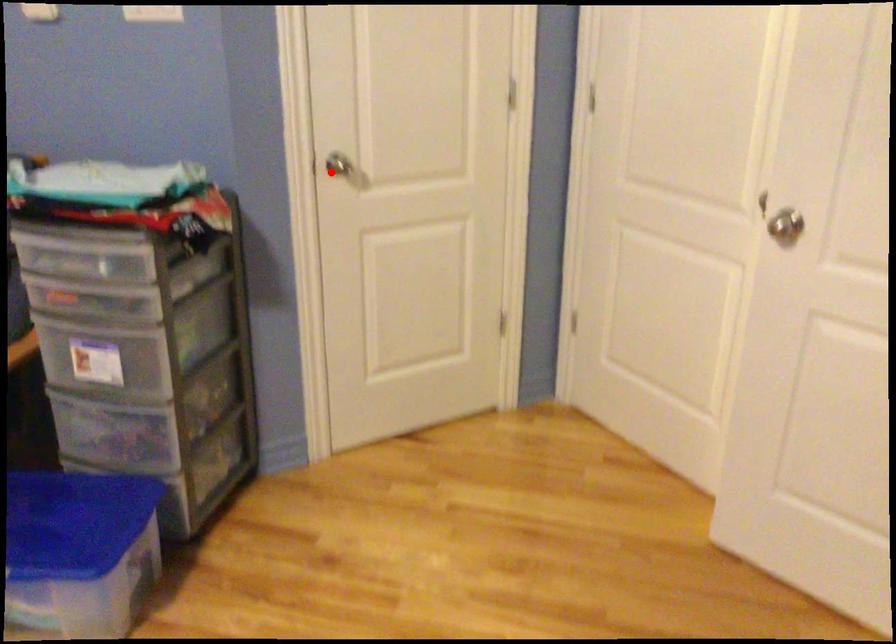
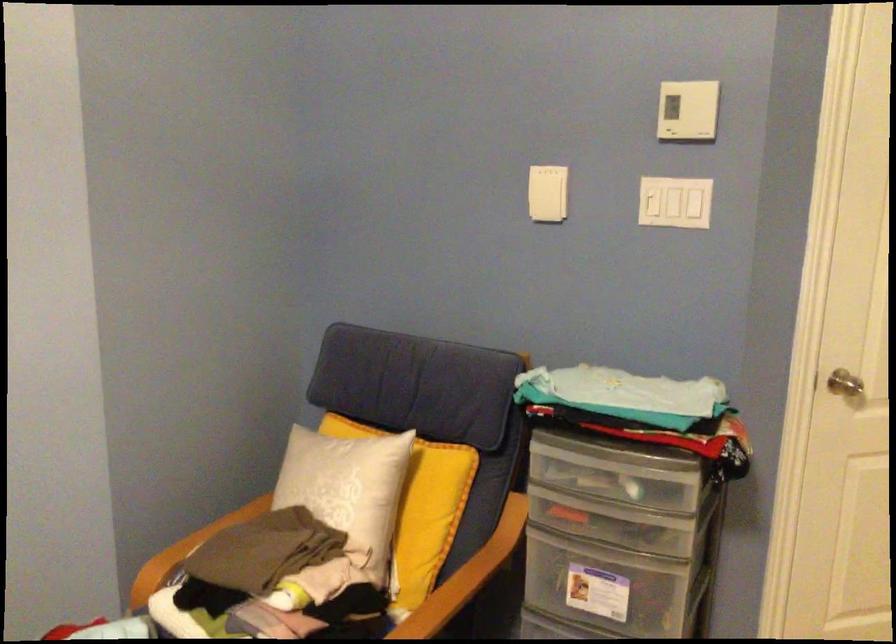
Question: I am providing you with two images of the same scene from different viewpoints. Given a red point in image1, look at the same physical point in image2. Is it:

Choices:
 (A) Closer to the viewpoint
 (B) Farther from the viewpoint

Answer: (A)